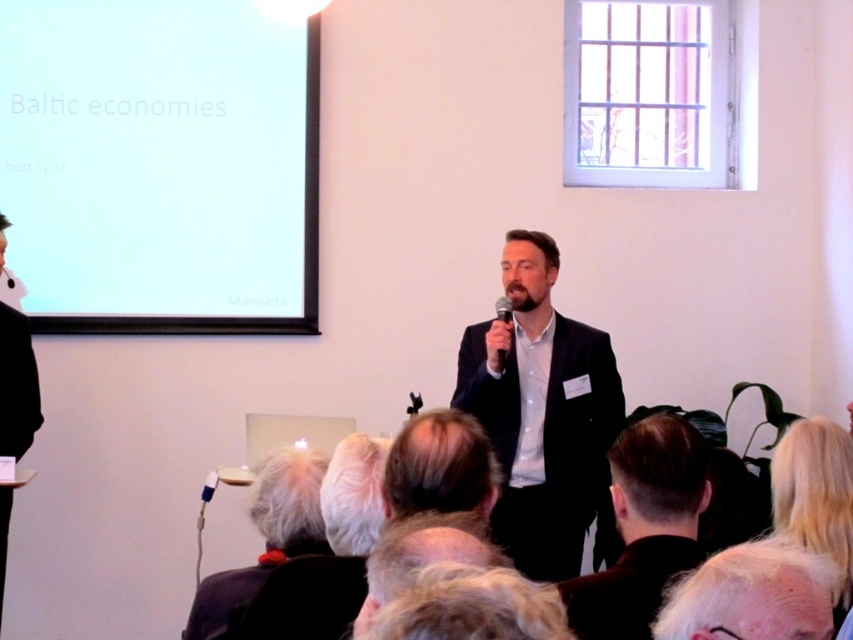
Question: Which object appears closest to the camera in this image?

Choices:
 (A) dark brown hair at lower center
 (B) black matte microphone at upper left

Answer: (A)

Question: Which point is closer to the camera?

Choices:
 (A) (4, 268)
 (B) (657, 481)
 (C) (318, 532)
 (D) (502, 456)

Answer: (B)

Question: Is the position of dark suit at center less distant than that of blonde hair at upper right?

Choices:
 (A) no
 (B) yes

Answer: (A)

Question: Is white hair at lower center thinner than black suit at left?

Choices:
 (A) yes
 (B) no

Answer: (B)

Question: Can you confirm if white hair at lower center is positioned below blonde hair at upper right?

Choices:
 (A) yes
 (B) no

Answer: (B)

Question: Which point is farther from the camera taking this photo?

Choices:
 (A) (503, 371)
 (B) (381, 561)
 (C) (3, 413)
 (D) (811, 586)

Answer: (C)